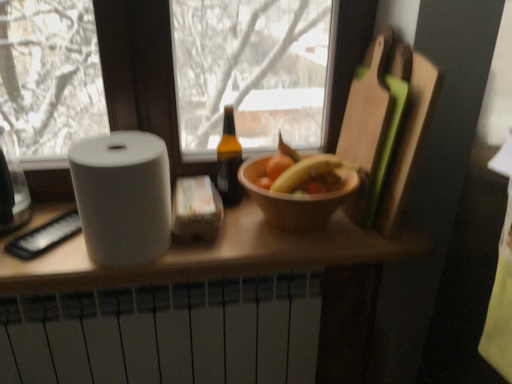
Locate an element on the screen. free space in front of brown glass bottle at center is located at coordinates (244, 239).